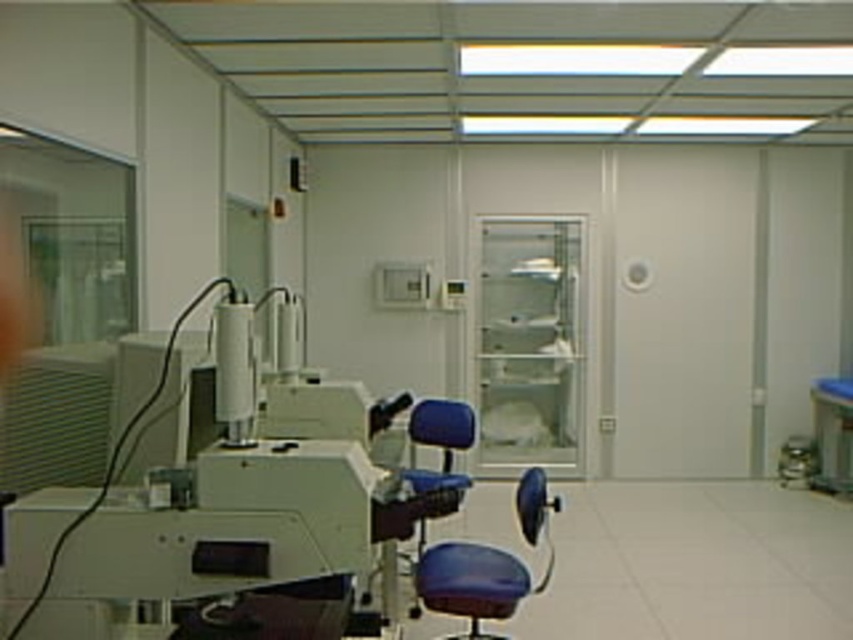
Does blue leather swivel chair at center have a greater width compared to matte blue chair at center?

Yes, blue leather swivel chair at center is wider than matte blue chair at center.

Who is shorter, blue leather swivel chair at center or matte blue chair at center?

With less height is matte blue chair at center.

Is point (479, 598) closer to viewer compared to point (433, 412)?

Yes, it is in front of point (433, 412).

You are a GUI agent. You are given a task and a screenshot of the screen. Output one action in this format:
    pyautogui.click(x=<x>, y=<y>)
    Task: Click on the blue leather swivel chair at center
    This screenshot has width=853, height=640.
    Given the screenshot: What is the action you would take?
    pyautogui.click(x=486, y=564)